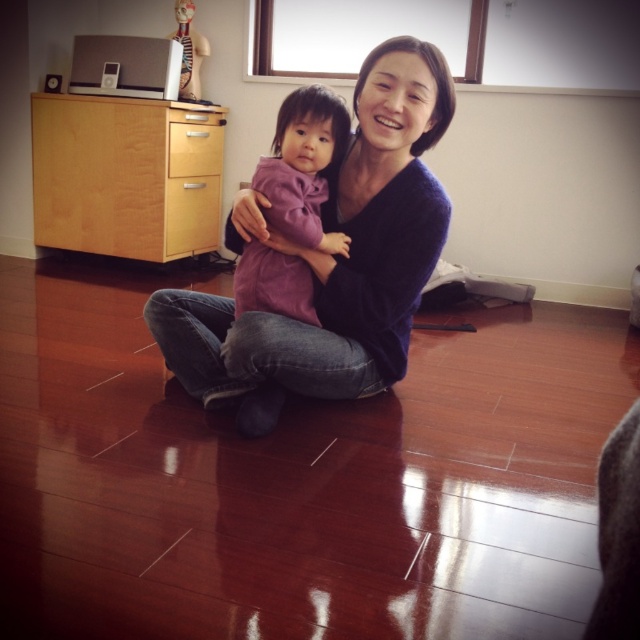
Between light wood dresser at left and purple soft fabric baby at center, which one is positioned higher?

light wood dresser at left is higher up.

Which of these two, light wood dresser at left or purple soft fabric baby at center, stands taller?

light wood dresser at left is taller.

Is point (209, 209) positioned after point (253, 250)?

Yes.

In order to click on light wood dresser at left in this screenshot , I will do `click(125, 177)`.

Is point (150, 124) closer to viewer compared to point (179, 211)?

That is True.

This screenshot has width=640, height=640. Identify the location of light wood dresser at left. (125, 177).

Does purple soft fabric baby at center come behind light wood drawer at left?

No.

Find the location of `purple soft fabric baby at center`. purple soft fabric baby at center is located at coordinates (304, 166).